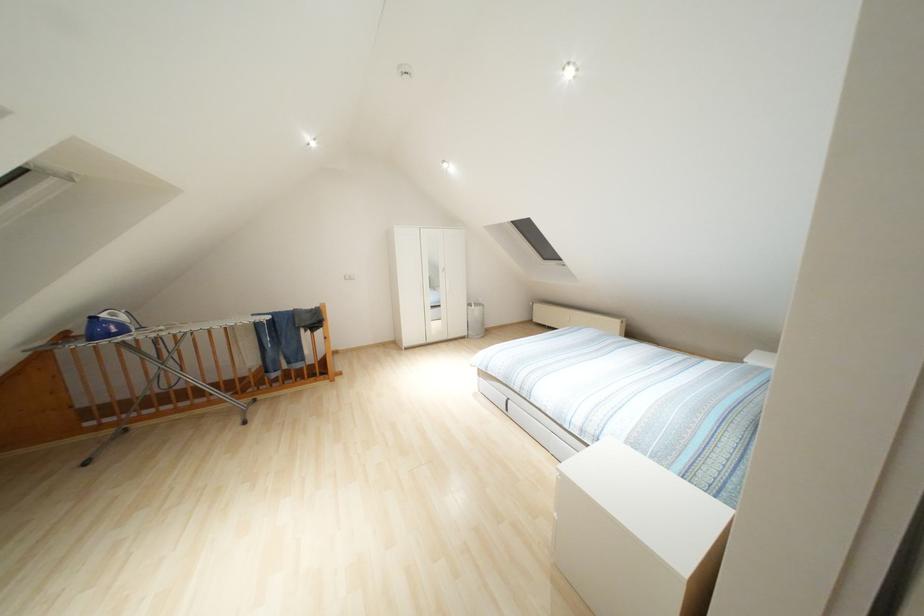
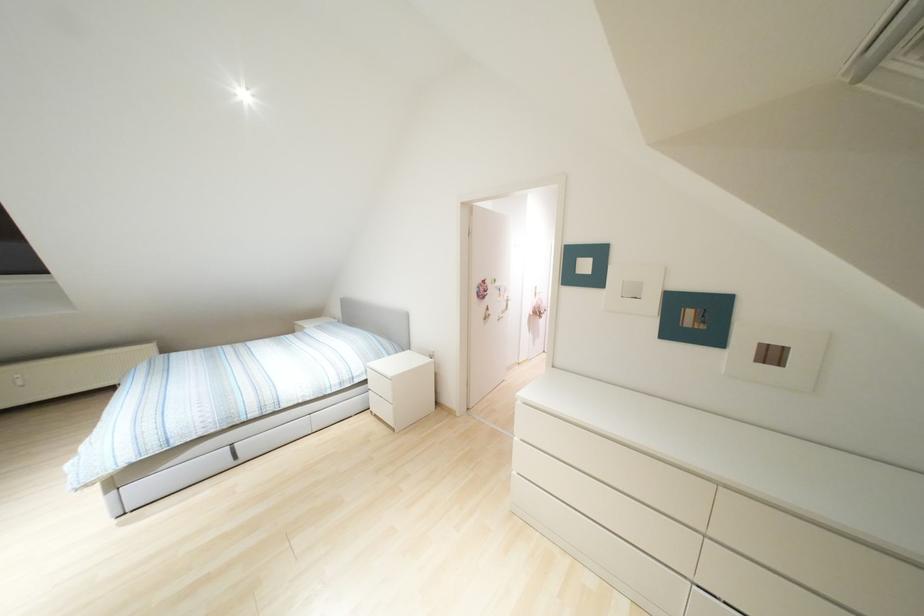
Find the pixel in the second image that matches point 505,408 in the first image.

(235, 456)